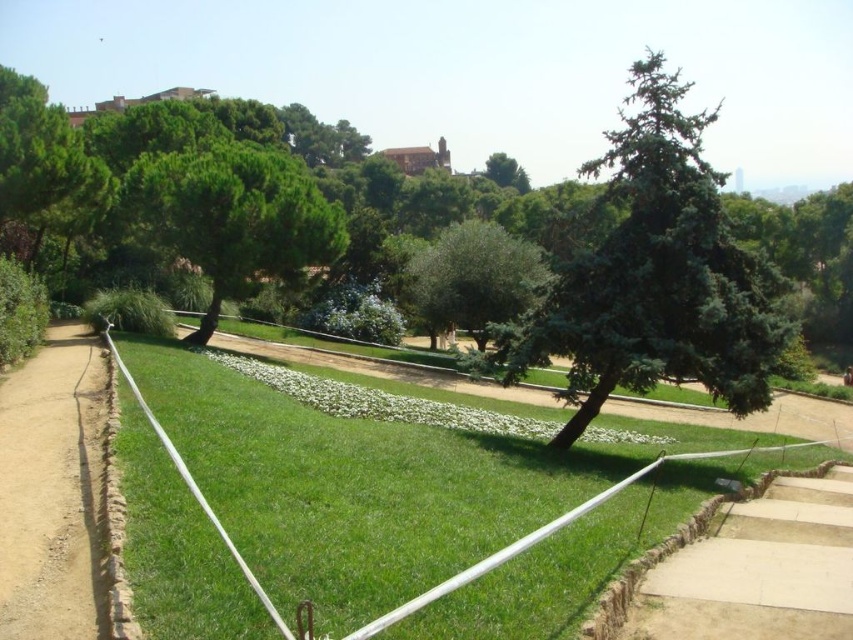
Is sandy beige stone steps at lower right smaller than green grassy at center?

Indeed, sandy beige stone steps at lower right has a smaller size compared to green grassy at center.

Looking at this image, is sandy beige stone steps at lower right thinner than green grassy at center?

Indeed, sandy beige stone steps at lower right has a lesser width compared to green grassy at center.

The width and height of the screenshot is (853, 640). I want to click on sandy beige stone steps at lower right, so click(x=758, y=573).

Where is `sandy beige stone steps at lower right`? Image resolution: width=853 pixels, height=640 pixels. sandy beige stone steps at lower right is located at coordinates (758, 573).

Which is in front, point (7, 497) or point (495, 246)?

Positioned in front is point (7, 497).

Between dirt/gravel path at left and green leafy tree at center, which one is positioned lower?

Positioned lower is dirt/gravel path at left.

The height and width of the screenshot is (640, 853). In order to click on dirt/gravel path at left in this screenshot , I will do `click(51, 490)`.

The image size is (853, 640). I want to click on dirt/gravel path at left, so click(x=51, y=490).

Between green leafy tree at center and green grassy at center, which one has more height?

green leafy tree at center

Does green leafy tree at center have a larger size compared to green grassy at center?

Incorrect, green leafy tree at center is not larger than green grassy at center.

Which is in front, point (489, 243) or point (679, 456)?

Point (679, 456)

Locate an element on the screen. green leafy tree at center is located at coordinates (474, 278).